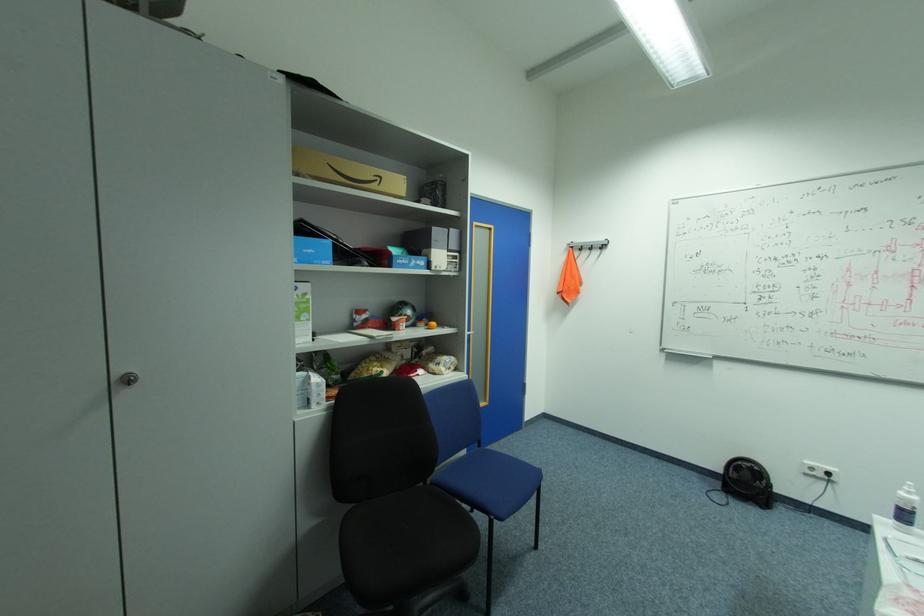
The image size is (924, 616). In order to click on blue chair sitting surface in this screenshot , I will do point(495,482).